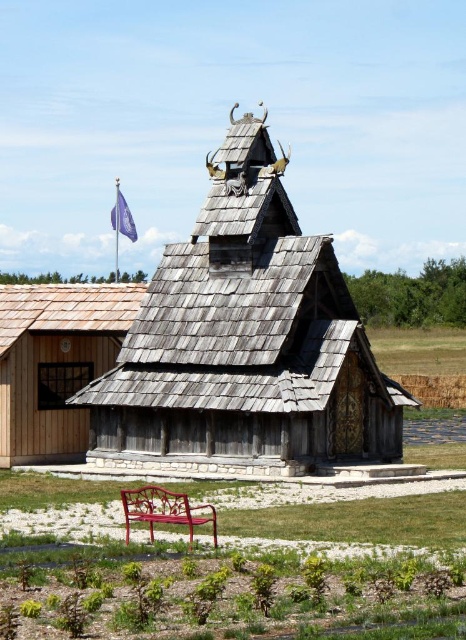
You are a maintenance worker needing to move a heavy tool from the weathered wood chapel at center to the metallic red bench at center. The tool requires a clear path of at least 20 feet. Can you safely move it without needing to adjust the path?

The distance between the weathered wood chapel at center and the metallic red bench at center is 18.35 feet, which is less than the required 20 feet. Therefore, you cannot safely move the tool without adjusting the path.

You are standing at the entrance of a park and see the weathered wood chapel at center. If you walk straight ahead, will you move towards the chapel?

Yes, walking straight ahead from the entrance will move you towards the weathered wood chapel at center since it is positioned at the center of the scene.

You are standing at the red metal bench in front of the shrine. You want to walk towards the shrine. Which point, point (214, 451) or point (163, 515), is closer to the shrine?

Point (214, 451) is behind point (163, 515), so point (214, 451) is closer to the shrine.